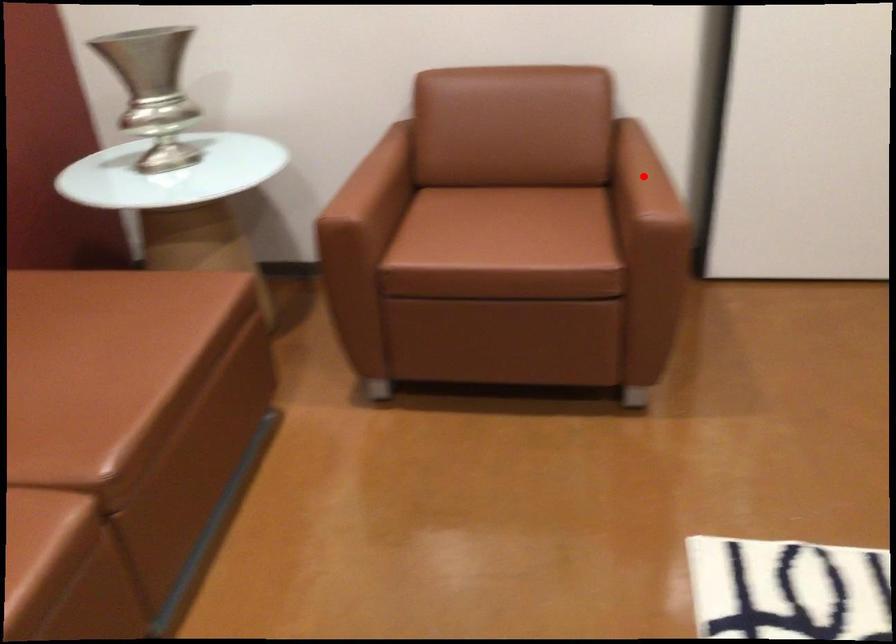
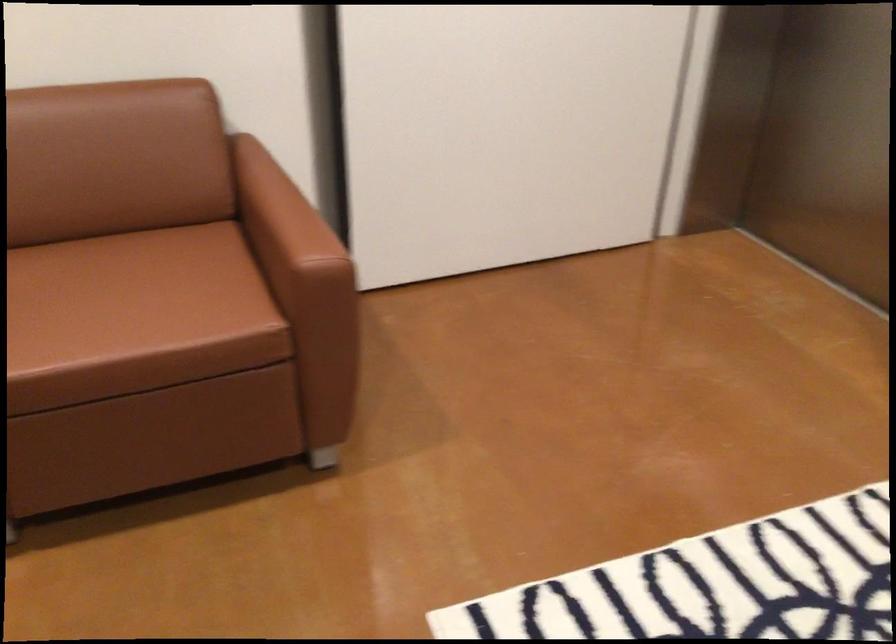
The point at the highlighted location is marked in the first image. Where is the corresponding point in the second image?

(282, 216)